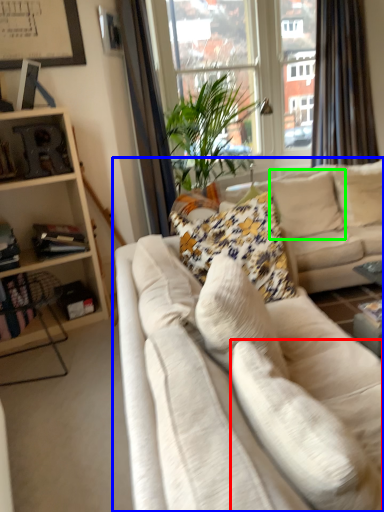
Question: Considering the real-world distances, which object is farthest from pillow (highlighted by a red box)? studio couch (highlighted by a blue box) or pillow (highlighted by a green box)?

Choices:
 (A) studio couch
 (B) pillow

Answer: (B)